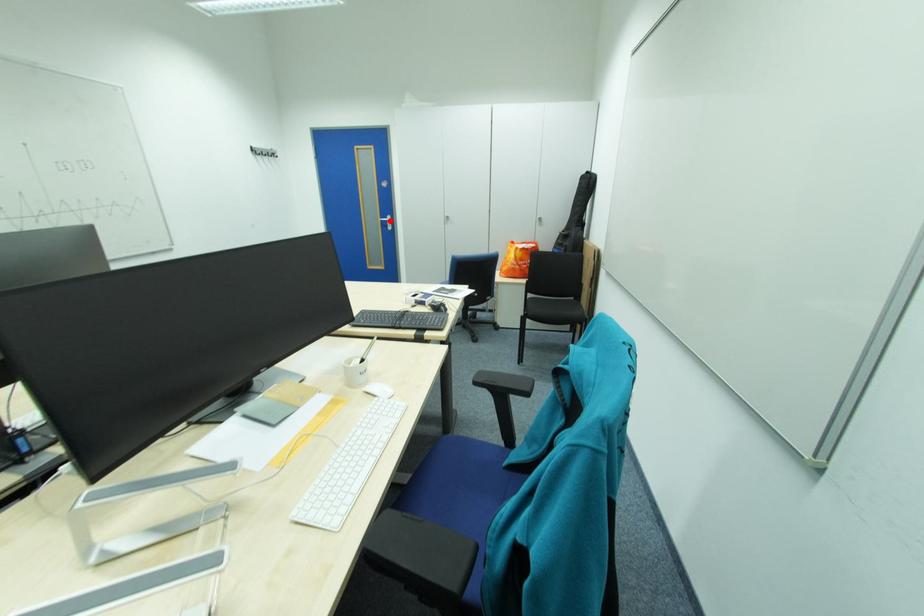
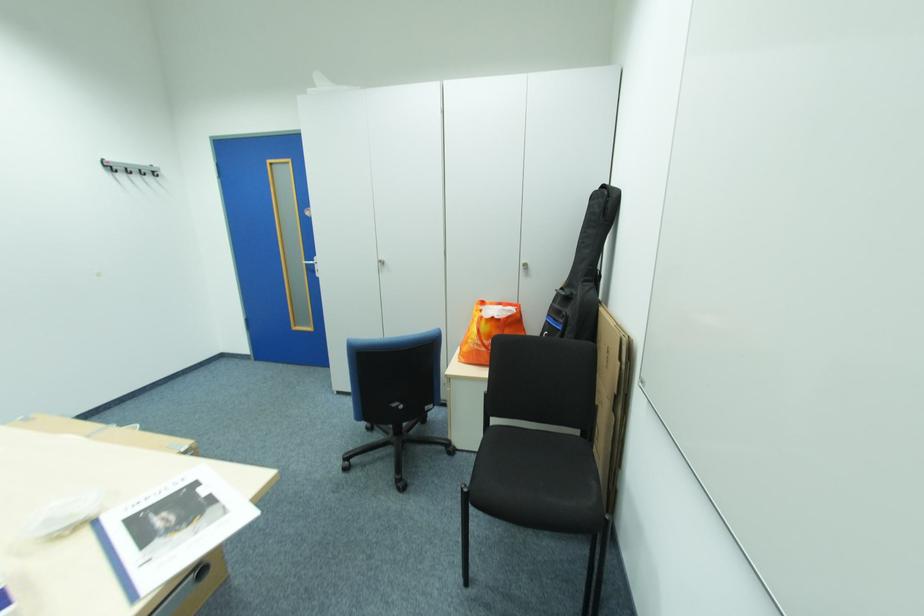
Question: I am providing you with two images of the same scene from different viewpoints. Image1 has a red point marked. In image2, the corresponding 3D location appears at what relative position? Reply with the corresponding letter.

Choices:
 (A) Closer
 (B) Farther

Answer: (B)